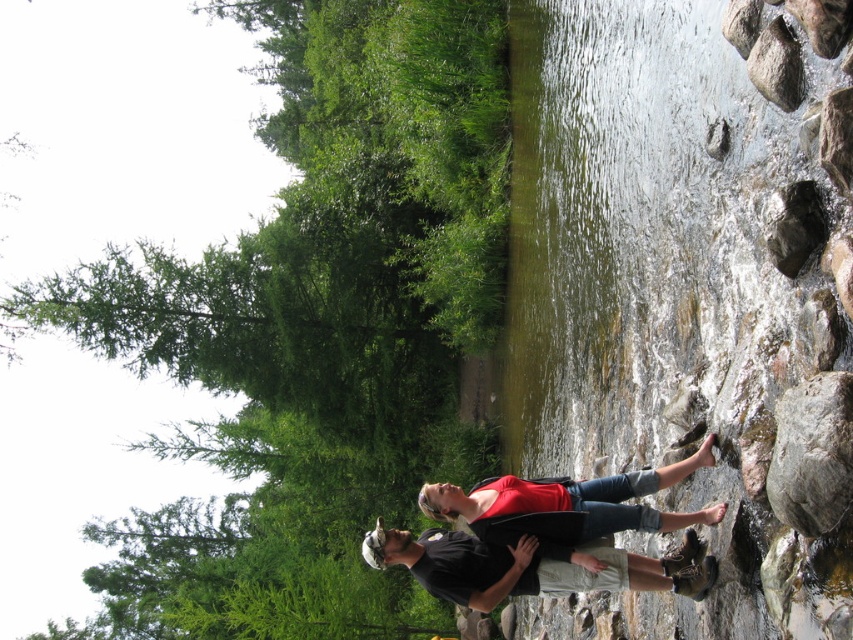
Is black matte shirt at center shorter than red matte shirt at center?

Yes.

Which is behind, point (543, 570) or point (700, 451)?

Positioned behind is point (543, 570).

Does point (550, 570) come closer to viewer compared to point (630, 516)?

That is False.

Where is `black matte shirt at center`? Image resolution: width=853 pixels, height=640 pixels. black matte shirt at center is located at coordinates pos(531,566).